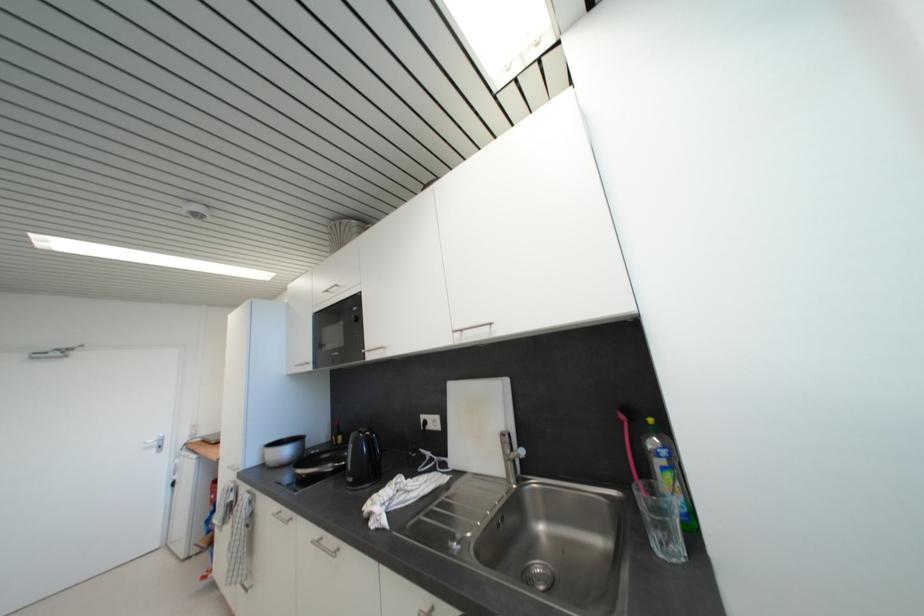
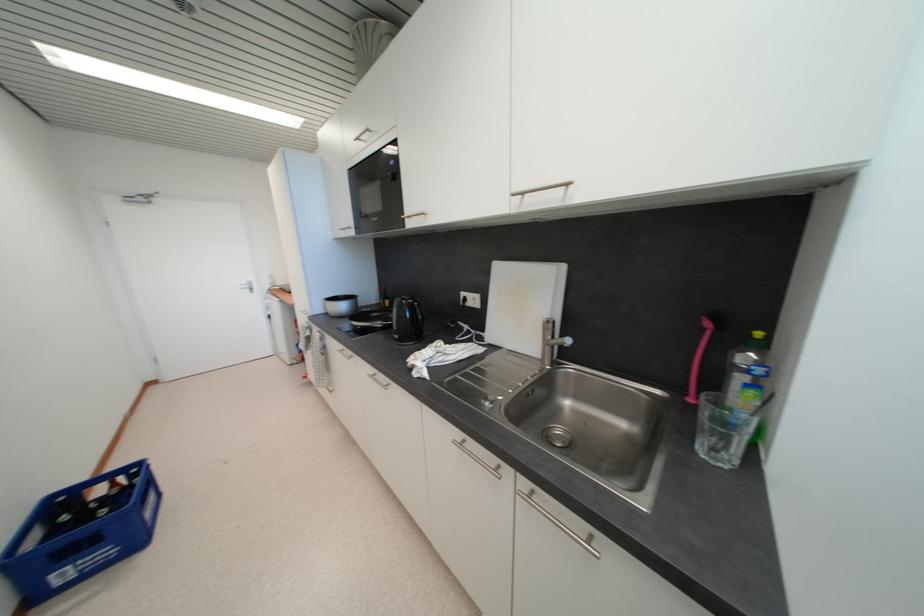
Find the pixel in the second image that matches pixel 357 483 in the first image.

(402, 339)